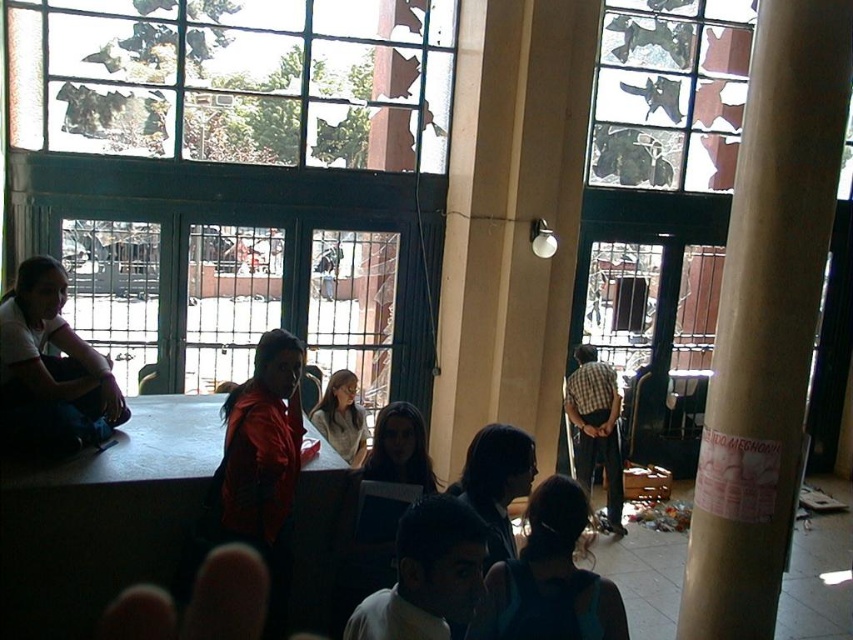
Does point (419, 48) lie behind point (653, 160)?

No, it is not.

Is transparent glass window at upper center bigger than translucent glass window at upper center?

Correct, transparent glass window at upper center is larger in size than translucent glass window at upper center.

Identify the location of transparent glass window at upper center. This screenshot has width=853, height=640. (235, 80).

Which of these two, translucent glass window at upper center or matte white shirt at left, stands taller?

translucent glass window at upper center is taller.

At what (x,y) coordinates should I click in order to perform the action: click on translucent glass window at upper center. Please return your answer as a coordinate pair (x, y). Looking at the image, I should click on (670, 92).

This screenshot has width=853, height=640. Identify the location of translucent glass window at upper center. (670, 92).

Which is in front, point (434, 540) or point (347, 420)?

Point (434, 540) is more forward.

Is the position of dark gray hoodie at center less distant than that of light gray sweater at center?

Yes, it is.

Is point (399, 579) in front of point (349, 381)?

Yes, point (399, 579) is in front of point (349, 381).

Where is `dark gray hoodie at center`? dark gray hoodie at center is located at coordinates (427, 573).